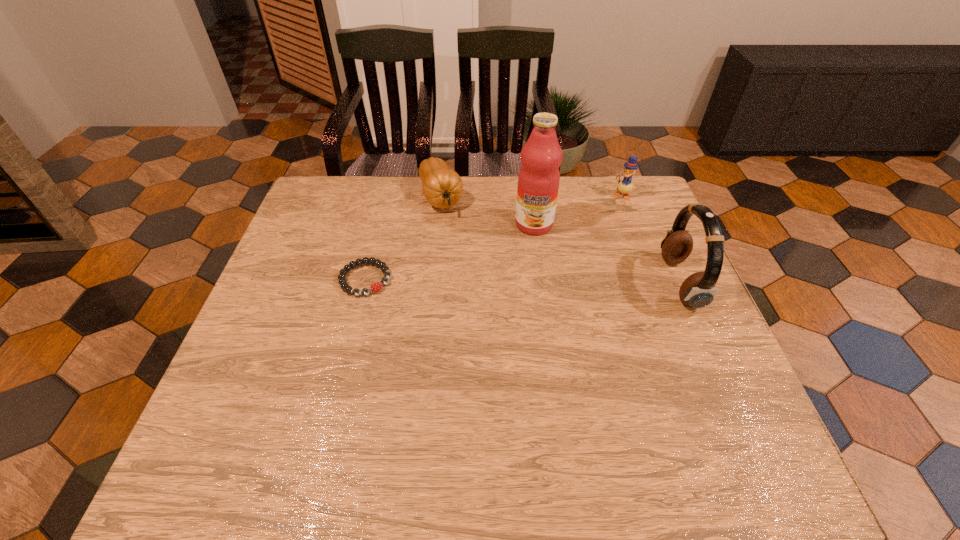
Where is `headset at the right edge`? The width and height of the screenshot is (960, 540). headset at the right edge is located at coordinates (698, 290).

Identify the location of duckling that is at the right edge. The height and width of the screenshot is (540, 960). (625, 186).

I want to click on object that is at the far right corner, so click(x=625, y=186).

You are a GUI agent. You are given a task and a screenshot of the screen. Output one action in this format:
    pyautogui.click(x=<x>, y=<y>)
    Task: Click on the vacant position at the far edge of the desktop
    The height and width of the screenshot is (540, 960).
    Given the screenshot: What is the action you would take?
    pyautogui.click(x=365, y=217)

Identify the location of free location at the near edge. The height and width of the screenshot is (540, 960). (404, 407).

Image resolution: width=960 pixels, height=540 pixels. I want to click on free space at the left edge, so click(x=315, y=312).

Find the location of a particular element. Image resolution: width=960 pixels, height=540 pixels. vacant area at the far left corner of the desktop is located at coordinates (333, 188).

Identify the location of vacant space at the near left corner. This screenshot has height=540, width=960. (259, 420).

What are the coordinates of `vacant space at the far right corner` in the screenshot? It's located at (609, 212).

Locate an element on the screen. This screenshot has width=960, height=540. empty space between the bracelet and the third object from right to left is located at coordinates (450, 252).